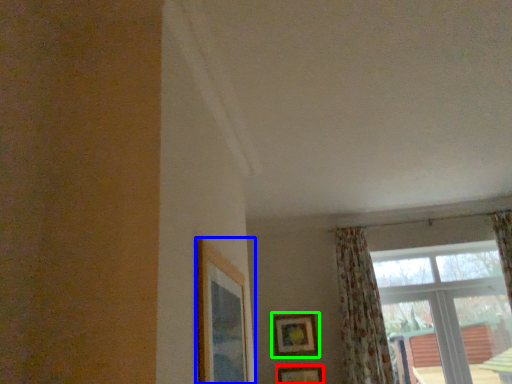
Question: Considering the real-world distances, which object is closest to picture frame (highlighted by a red box)? picture frame (highlighted by a blue box) or picture frame (highlighted by a green box).

Choices:
 (A) picture frame
 (B) picture frame

Answer: (B)